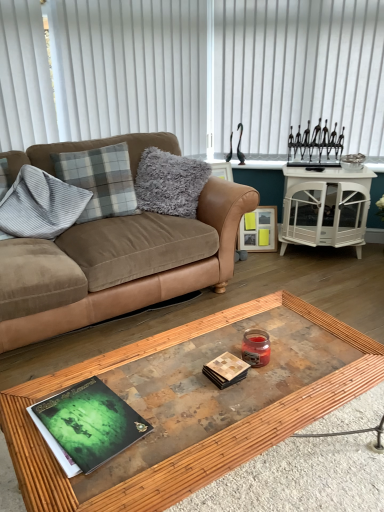
Question: Is plaid fabric pillow at upper left, which ranks as the second pillow in left-to-right order, aimed at gray fluffy pillow at upper left, arranged as the first pillow when viewed from the right?

Choices:
 (A) no
 (B) yes

Answer: (A)

Question: From a real-world perspective, is plaid fabric pillow at upper left, the 2th pillow in the right-to-left sequence, located higher than gray fluffy pillow at upper left, marked as the 3th pillow in a left-to-right arrangement?

Choices:
 (A) yes
 (B) no

Answer: (A)

Question: Is plaid fabric pillow at upper left, which ranks as the second pillow in left-to-right order, taller than gray fluffy pillow at upper left, marked as the 3th pillow in a left-to-right arrangement?

Choices:
 (A) no
 (B) yes

Answer: (A)

Question: Is plaid fabric pillow at upper left, which ranks as the second pillow in left-to-right order, far away from gray fluffy pillow at upper left, marked as the 3th pillow in a left-to-right arrangement?

Choices:
 (A) no
 (B) yes

Answer: (A)

Question: Can you confirm if plaid fabric pillow at upper left, which ranks as the second pillow in left-to-right order, is positioned to the left of gray fluffy pillow at upper left, marked as the 3th pillow in a left-to-right arrangement?

Choices:
 (A) yes
 (B) no

Answer: (A)

Question: Is white vertical blinds at upper left, which is the first blind from left to right, to the left or to the right of gray fluffy pillow at upper left, arranged as the first pillow when viewed from the right, in the image?

Choices:
 (A) right
 (B) left

Answer: (B)

Question: Is white vertical blinds at upper left, which is the first blind from left to right, in front of or behind gray fluffy pillow at upper left, arranged as the first pillow when viewed from the right, in the image?

Choices:
 (A) behind
 (B) front

Answer: (B)

Question: Do you think white vertical blinds at upper left, which is the first blind from left to right, is within gray fluffy pillow at upper left, arranged as the first pillow when viewed from the right, or outside of it?

Choices:
 (A) outside
 (B) inside

Answer: (A)

Question: From their relative heights in the image, would you say white vertical blinds at upper left, the second blind when ordered from right to left, is taller or shorter than gray fluffy pillow at upper left, arranged as the first pillow when viewed from the right?

Choices:
 (A) short
 (B) tall

Answer: (B)

Question: Considering the positions of suede couch at left and green matte magazine at center, marked as the first magazine in a right-to-left arrangement, in the image, is suede couch at left taller or shorter than green matte magazine at center, marked as the first magazine in a right-to-left arrangement,?

Choices:
 (A) tall
 (B) short

Answer: (A)

Question: Is suede couch at left situated inside green matte magazine at center, which ranks as the 2th magazine in left-to-right order, or outside?

Choices:
 (A) inside
 (B) outside

Answer: (B)

Question: From a real-world perspective, is suede couch at left above or below green matte magazine at center, marked as the first magazine in a right-to-left arrangement?

Choices:
 (A) below
 (B) above

Answer: (B)

Question: Looking at their shapes, would you say suede couch at left is wider or thinner than green matte magazine at center, which ranks as the 2th magazine in left-to-right order?

Choices:
 (A) wide
 (B) thin

Answer: (A)

Question: Looking at the image, does green matte book at center, the 2th magazine positioned from the right, seem bigger or smaller compared to suede couch at left?

Choices:
 (A) small
 (B) big

Answer: (A)

Question: From the image's perspective, is green matte book at center, the first magazine viewed from the left, above or below suede couch at left?

Choices:
 (A) above
 (B) below

Answer: (B)